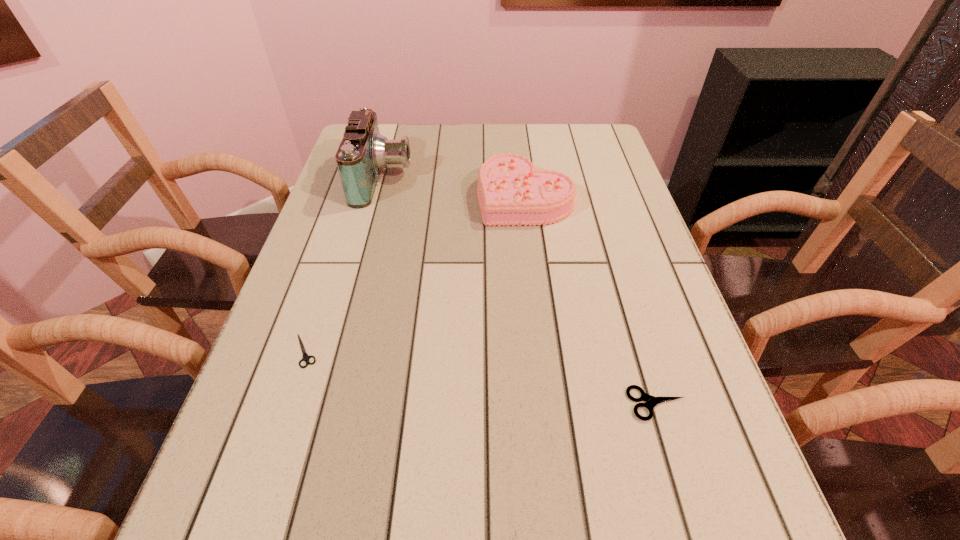
Identify the location of free location located 0.310m on the back of the shorter shears. (345, 231).

The image size is (960, 540). I want to click on object at the far edge, so tap(363, 152).

The height and width of the screenshot is (540, 960). What are the coordinates of `camcorder that is at the left edge` in the screenshot? It's located at (363, 152).

Where is `shears present at the left edge`? shears present at the left edge is located at coordinates (306, 357).

The image size is (960, 540). Identify the location of cake that is at the right edge. (511, 191).

Find the location of a particular element. shears located in the right edge section of the desktop is located at coordinates (651, 401).

Locate an element on the screen. The width and height of the screenshot is (960, 540). object that is at the far left corner is located at coordinates (363, 152).

In the image, there is a desktop. Find the location of `vacant space at the far edge`. vacant space at the far edge is located at coordinates (439, 132).

This screenshot has height=540, width=960. In the image, there is a desktop. In order to click on vacant region at the left edge in this screenshot , I will do `click(316, 241)`.

Locate an element on the screen. vacant space at the right edge of the desktop is located at coordinates (629, 194).